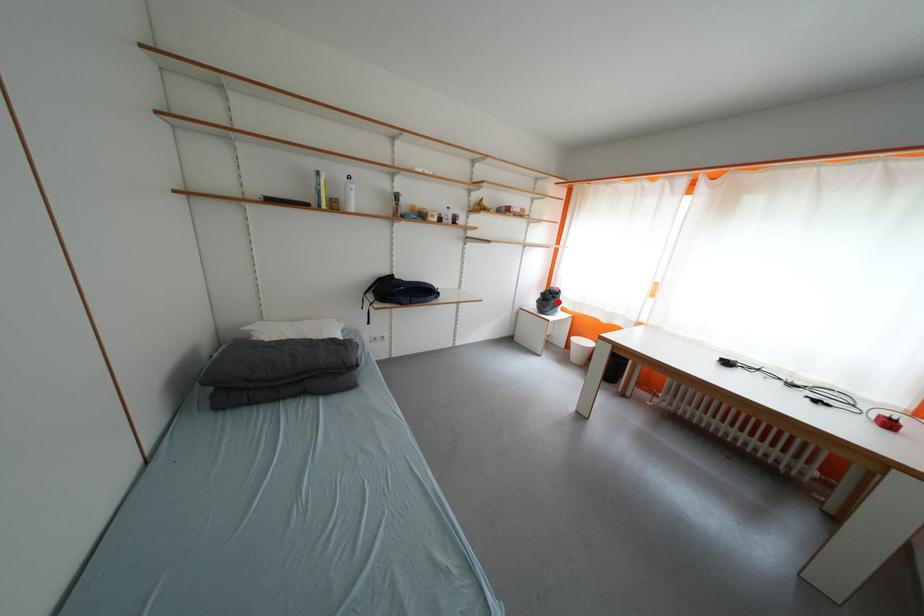
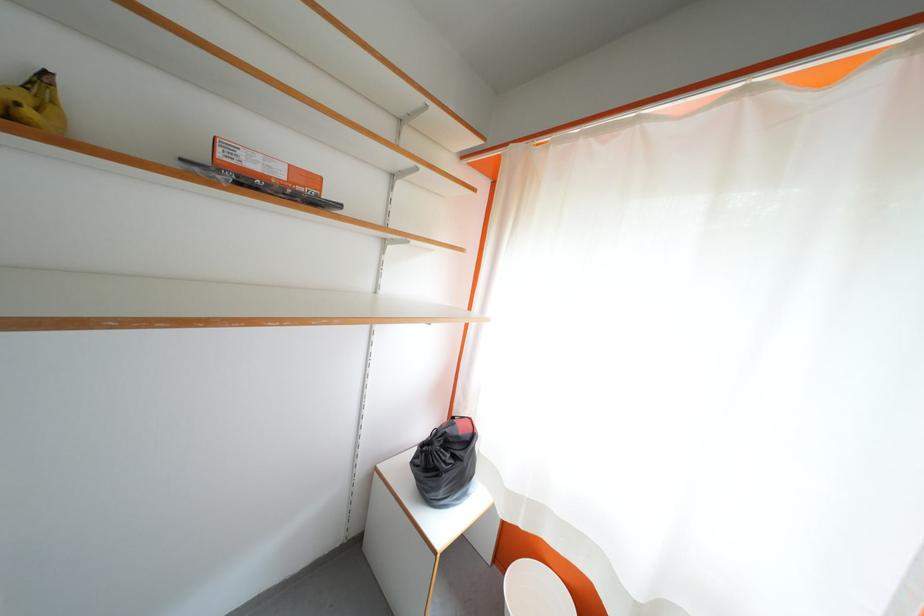
Question: A red point is marked in image1. In image2, is the corresponding 3D point closer to the camera or farther? Reply with the corresponding letter.

Choices:
 (A) The corresponding 3D point is closer.
 (B) The corresponding 3D point is farther.

Answer: (B)